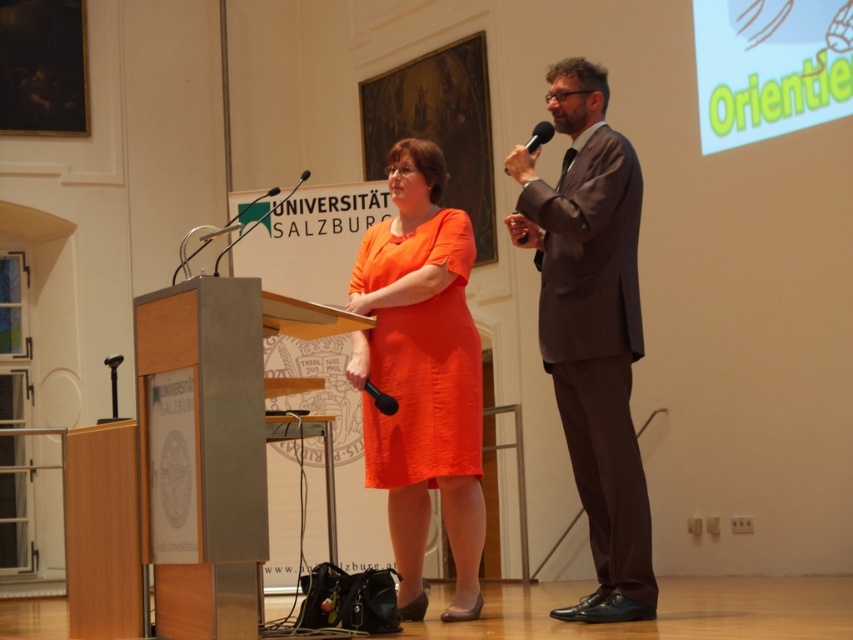
Who is taller, metallic silver podium at center or dark brown suit at center?

Standing taller between the two is dark brown suit at center.

Who is more distant from viewer, (334, 330) or (572, 236)?

The point (334, 330) is more distant.

Measure the distance between metallic silver podium at center and camera.

metallic silver podium at center and camera are 4.92 meters apart from each other.

Locate an element on the screen. This screenshot has height=640, width=853. metallic silver podium at center is located at coordinates point(212,444).

Image resolution: width=853 pixels, height=640 pixels. Identify the location of orange satin dress at center. (421, 356).

Where is `orange satin dress at center`? orange satin dress at center is located at coordinates (421, 356).

Which is behind, point (624, 380) or point (540, 122)?

The point (540, 122) is more distant.

Measure the distance from dark brown suit at center to black plastic microphone at upper right.

The distance of dark brown suit at center from black plastic microphone at upper right is 33.23 inches.

Who is more forward, [579,227] or [505,168]?

Point [579,227]

You are a GUI agent. You are given a task and a screenshot of the screen. Output one action in this format:
    pyautogui.click(x=<x>, y=<y>)
    Task: Click on the dark brown suit at center
    
    Given the screenshot: What is the action you would take?
    pyautogui.click(x=592, y=328)